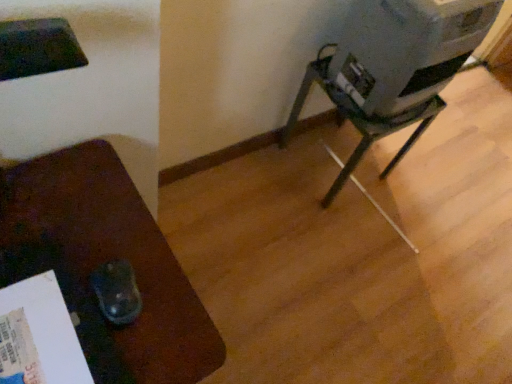
Question: Is metallic gray projector at center-right, which ranks as the second furniture in front-to-back order, not close to matte brown mouse pad at left, the first furniture viewed from the left?

Choices:
 (A) no
 (B) yes

Answer: (A)

Question: Is metallic gray projector at center-right, arranged as the second furniture when ordered from the bottom, oriented towards matte brown mouse pad at left, which is the 2th furniture in top-to-bottom order?

Choices:
 (A) no
 (B) yes

Answer: (A)

Question: Is metallic gray projector at center-right, the 2th furniture in the left-to-right sequence, not inside matte brown mouse pad at left, which is the second furniture in right-to-left order?

Choices:
 (A) no
 (B) yes

Answer: (B)

Question: Considering the relative positions of metallic gray projector at center-right, the 2th furniture in the left-to-right sequence, and matte brown mouse pad at left, which is the first furniture from front to back, in the image provided, is metallic gray projector at center-right, the 2th furniture in the left-to-right sequence, to the left of matte brown mouse pad at left, which is the first furniture from front to back, from the viewer's perspective?

Choices:
 (A) yes
 (B) no

Answer: (B)

Question: From a real-world perspective, is metallic gray projector at center-right, arranged as the second furniture when ordered from the bottom, positioned over matte brown mouse pad at left, the first furniture viewed from the left, based on gravity?

Choices:
 (A) no
 (B) yes

Answer: (A)

Question: From a real-world perspective, is metallic gray water cooler at right above or below matte brown mouse pad at left, which is the second furniture in right-to-left order?

Choices:
 (A) below
 (B) above

Answer: (B)

Question: From the image's perspective, is metallic gray water cooler at right located above or below matte brown mouse pad at left, positioned as the 2th furniture in back-to-front order?

Choices:
 (A) above
 (B) below

Answer: (A)

Question: Considering their positions, is metallic gray water cooler at right located in front of or behind matte brown mouse pad at left, acting as the first furniture starting from the bottom?

Choices:
 (A) behind
 (B) front

Answer: (A)

Question: Would you say metallic gray water cooler at right is to the left or to the right of matte brown mouse pad at left, the first furniture viewed from the left, in the picture?

Choices:
 (A) left
 (B) right

Answer: (B)

Question: From the image's perspective, is matte brown mouse pad at left, which is the second furniture in right-to-left order, above or below metallic gray water cooler at right?

Choices:
 (A) below
 (B) above

Answer: (A)

Question: In terms of width, does matte brown mouse pad at left, which is the second furniture in right-to-left order, look wider or thinner when compared to metallic gray water cooler at right?

Choices:
 (A) thin
 (B) wide

Answer: (B)

Question: Looking at the image, does matte brown mouse pad at left, which is the first furniture from front to back, seem bigger or smaller compared to metallic gray water cooler at right?

Choices:
 (A) small
 (B) big

Answer: (B)

Question: Considering the relative positions of matte brown mouse pad at left, the first furniture viewed from the left, and metallic gray water cooler at right in the image provided, is matte brown mouse pad at left, the first furniture viewed from the left, to the left or to the right of metallic gray water cooler at right?

Choices:
 (A) left
 (B) right

Answer: (A)

Question: Do you think metallic gray water cooler at right is within metallic gray projector at center-right, arranged as the 1th furniture when viewed from the right, or outside of it?

Choices:
 (A) inside
 (B) outside

Answer: (B)

Question: Looking at their shapes, would you say metallic gray water cooler at right is wider or thinner than metallic gray projector at center-right, the 1th furniture from the top?

Choices:
 (A) thin
 (B) wide

Answer: (A)